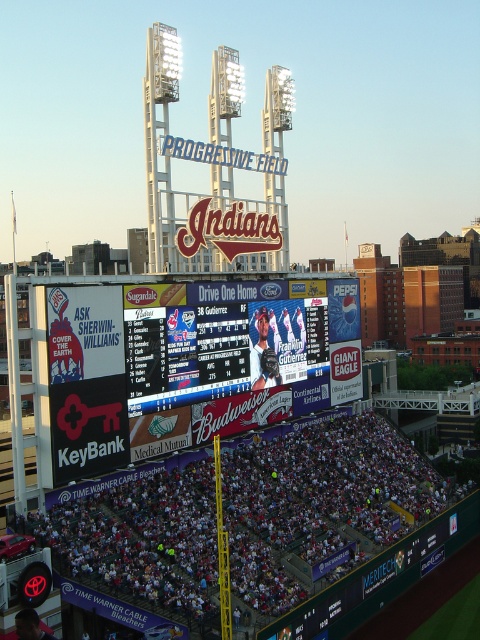
In the scene shown: You are a photographer at Progressive Field and want to capture a photo that includes both the white fabric crowd at lower center and the white digital scoreboard at center. Which object will appear smaller in the photo?

The white fabric crowd at lower center will appear smaller in the photo because it has a lesser height compared to the white digital scoreboard at center.

You are a photographer at Progressive Field and want to capture a photo that includes both the white fabric crowd at lower center and the white digital scoreboard at center. Based on their positions, which object should appear lower in the photo?

The white fabric crowd at lower center appears lower in the photo than the white digital scoreboard at center because it is positioned below it.

You are a drone operator who needs to fly a drone from the white fabric crowd at lower center to the white digital scoreboard at center. What is the minimum distance the drone must travel?

The minimum distance the drone must travel is 9.23 meters between white fabric crowd at lower center and white digital scoreboard at center.